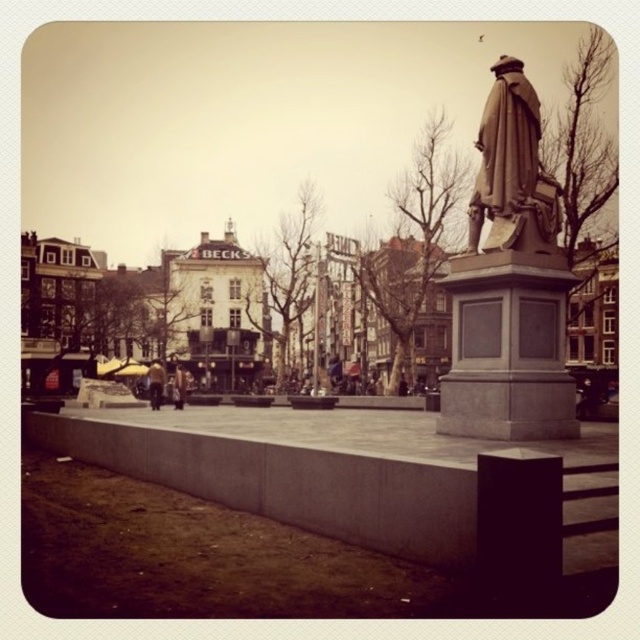
You are an urban planner assessing the square. You notice the bronze statue at center and the brown leather jacket at center. Which object takes up more area in the square?

The brown leather jacket at center occupies more space than the bronze statue at center.

You are standing in the urban square and want to take a photo of the bronze statue at center. To ensure the statue is the main focus, where should you position yourself relative to the statue?

The bronze statue at center is located at point (512, 168), so positioning yourself directly in front of it would ensure it is the main focus of your photo.